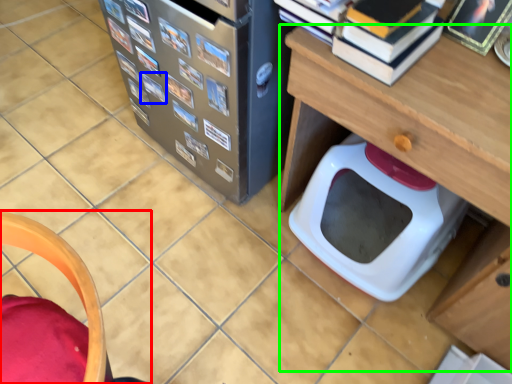
Question: Which object is the farthest from furniture (highlighted by a red box)? Choose among these: book (highlighted by a blue box) or table (highlighted by a green box).

Choices:
 (A) book
 (B) table

Answer: (A)